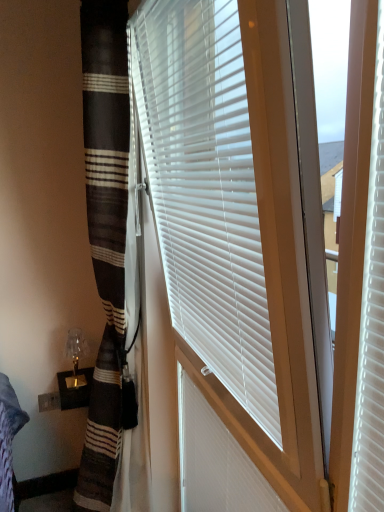
The width and height of the screenshot is (384, 512). I want to click on translucent glass table lamp at lower left, so click(75, 356).

Identify the location of white plastic blinds at center. This screenshot has height=512, width=384. (206, 191).

Considering the positions of point (70, 383) and point (258, 489), is point (70, 383) closer or farther from the camera than point (258, 489)?

Clearly, point (70, 383) is more distant from the camera than point (258, 489).

Between translucent glass table lamp at lower left and white plastic shutter at center, which one appears on the right side from the viewer's perspective?

white plastic shutter at center is more to the right.

Is white plastic shutter at center surrounded by translucent glass table lamp at lower left?

No.

Considering the sizes of objects translucent glass table lamp at lower left and white plastic shutter at center in the image provided, who is shorter, translucent glass table lamp at lower left or white plastic shutter at center?

translucent glass table lamp at lower left.

From the image's perspective, is white plastic shutter at center beneath white plastic blinds at center?

Correct, white plastic shutter at center appears lower than white plastic blinds at center in the image.

From their relative heights in the image, would you say white plastic shutter at center is taller or shorter than white plastic blinds at center?

white plastic shutter at center is shorter than white plastic blinds at center.

Is white plastic shutter at center at the right side of white plastic blinds at center?

Correct, you'll find white plastic shutter at center to the right of white plastic blinds at center.

Find the location of `window blind located above the white plastic shutter at center (from the image's perspective)`. window blind located above the white plastic shutter at center (from the image's perspective) is located at coordinates (206, 191).

Is white plastic shutter at center far from translucent glass table lamp at lower left?

No, white plastic shutter at center is not far away from translucent glass table lamp at lower left.

At what (x,y) coordinates should I click in order to perform the action: click on shutter below the translucent glass table lamp at lower left (from the image's perspective). Please return your answer as a coordinate pair (x, y). Looking at the image, I should click on (216, 461).

From a real-world perspective, is white plastic shutter at center physically above translucent glass table lamp at lower left?

No.

Does white plastic shutter at center have a larger size compared to translucent glass table lamp at lower left?

Correct, white plastic shutter at center is larger in size than translucent glass table lamp at lower left.

Can you confirm if white plastic blinds at center is positioned to the right of white plastic shutter at center?

No, white plastic blinds at center is not to the right of white plastic shutter at center.

Would you say white plastic blinds at center is outside white plastic shutter at center?

Yes.

From the picture: From the image's perspective, is white plastic blinds at center beneath white plastic shutter at center?

Actually, white plastic blinds at center appears above white plastic shutter at center in the image.

Is white plastic blinds at center smaller than white plastic shutter at center?

No.

Is white plastic blinds at center inside or outside of translucent glass table lamp at lower left?

white plastic blinds at center is spatially situated outside translucent glass table lamp at lower left.

Is white plastic blinds at center aimed at translucent glass table lamp at lower left?

No, white plastic blinds at center is not oriented towards translucent glass table lamp at lower left.

Is white plastic blinds at center bigger than translucent glass table lamp at lower left?

Correct, white plastic blinds at center is larger in size than translucent glass table lamp at lower left.

Does white plastic blinds at center lie in front of translucent glass table lamp at lower left?

Yes, the depth of white plastic blinds at center is less than that of translucent glass table lamp at lower left.

Which is behind, point (83, 337) or point (233, 345)?

The point (83, 337) is farther from the camera.

Is translucent glass table lamp at lower left further to camera compared to white plastic blinds at center?

Yes, translucent glass table lamp at lower left is further from the viewer.

From a real-world perspective, is translucent glass table lamp at lower left positioned over white plastic blinds at center based on gravity?

Incorrect, from a real-world perspective, translucent glass table lamp at lower left is lower than white plastic blinds at center.

Is translucent glass table lamp at lower left not inside white plastic blinds at center?

That's correct, translucent glass table lamp at lower left is outside of white plastic blinds at center.

At what (x,y) coordinates should I click in order to perform the action: click on shutter in front of the translucent glass table lamp at lower left. Please return your answer as a coordinate pair (x, y). Looking at the image, I should click on [216, 461].

This screenshot has height=512, width=384. In order to click on shutter below the white plastic blinds at center (from a real-world perspective) in this screenshot , I will do `click(216, 461)`.

Which object lies nearer to the anchor point translucent glass table lamp at lower left, white plastic blinds at center or white plastic shutter at center?

white plastic shutter at center is positioned closer to the anchor translucent glass table lamp at lower left.

From the image, which object appears to be farther from translucent glass table lamp at lower left, white plastic shutter at center or white plastic blinds at center?

white plastic blinds at center.

Estimate the real-world distances between objects in this image. Which object is further from white plastic blinds at center, translucent glass table lamp at lower left or white plastic shutter at center?

Result: The object further to white plastic blinds at center is translucent glass table lamp at lower left.

Based on the photo, considering their positions, is translucent glass table lamp at lower left positioned further to white plastic shutter at center than white plastic blinds at center?

translucent glass table lamp at lower left is positioned further to the anchor white plastic shutter at center.

Estimate the real-world distances between objects in this image. Which object is further from white plastic blinds at center, white plastic shutter at center or translucent glass table lamp at lower left?

translucent glass table lamp at lower left is positioned further to the anchor white plastic blinds at center.

Consider the image. When comparing their distances from white plastic shutter at center, does white plastic blinds at center or translucent glass table lamp at lower left seem further?

translucent glass table lamp at lower left lies further to white plastic shutter at center than the other object.

Identify the location of shutter positioned between white plastic blinds at center and translucent glass table lamp at lower left from near to far. The width and height of the screenshot is (384, 512). (216, 461).